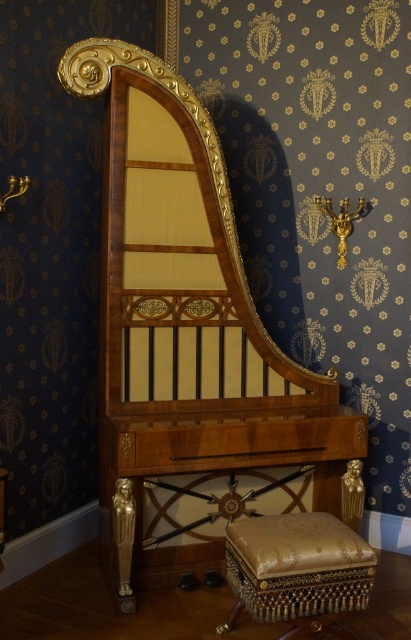
You are arranging a living room and want to place the walnut wood harpsichord at center and the gold textured cushion at lower center. Considering their sizes, which object should you place first to ensure proper spacing?

The walnut wood harpsichord at center should be placed first because it is larger than the gold textured cushion at lower center, ensuring enough space is allocated for it.

You are standing in front of the hall tree and want to place a small decorative item on the closest object to you. Which object should you choose between the walnut wood harpsichord at center and the gold textured cushion at lower center?

The walnut wood harpsichord at center is closer to you than the gold textured cushion at lower center, so you should place the decorative item on the walnut wood harpsichord at center.